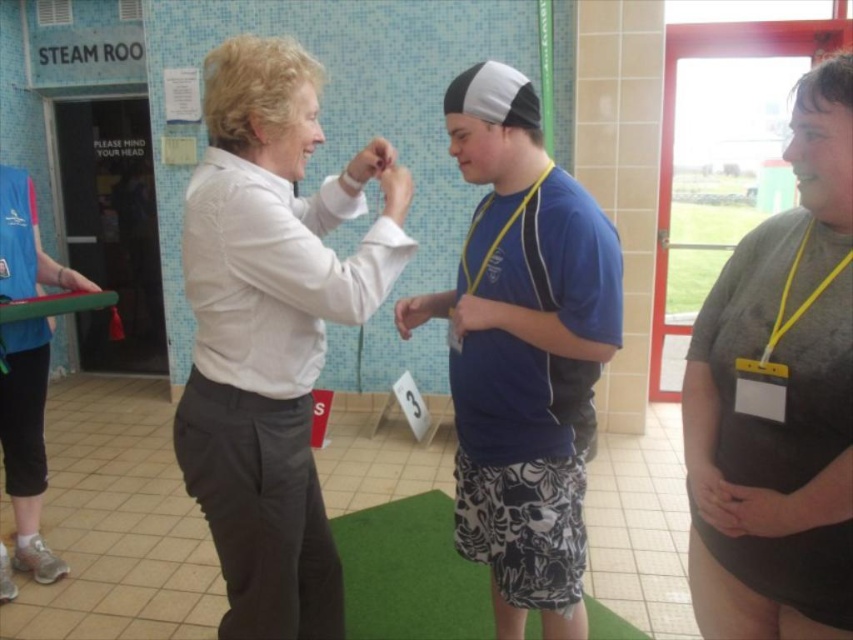
Looking at this image, does blue fabric shirt at center have a larger size compared to gray matte t-shirt at center?

Yes, blue fabric shirt at center is bigger than gray matte t-shirt at center.

Is blue fabric shirt at center positioned in front of gray matte t-shirt at center?

No.

What do you see at coordinates (523, 352) in the screenshot?
I see `blue fabric shirt at center` at bounding box center [523, 352].

The height and width of the screenshot is (640, 853). Identify the location of blue fabric shirt at center. (523, 352).

Is white smooth shirt at center wider than blue fabric shirt at center?

Indeed, white smooth shirt at center has a greater width compared to blue fabric shirt at center.

Does white smooth shirt at center lie in front of blue fabric shirt at center?

That is True.

What do you see at coordinates (271, 330) in the screenshot?
I see `white smooth shirt at center` at bounding box center [271, 330].

Locate an element on the screen. The width and height of the screenshot is (853, 640). white smooth shirt at center is located at coordinates (271, 330).

Is the position of white smooth shirt at center less distant than that of gray matte t-shirt at center?

No, it is behind gray matte t-shirt at center.

Does white smooth shirt at center have a greater width compared to gray matte t-shirt at center?

Yes, white smooth shirt at center is wider than gray matte t-shirt at center.

Is point (207, 275) behind point (791, 484)?

Yes, it is behind point (791, 484).

At what (x,y) coordinates should I click in order to perform the action: click on white smooth shirt at center. Please return your answer as a coordinate pair (x, y). Looking at the image, I should click on (271, 330).